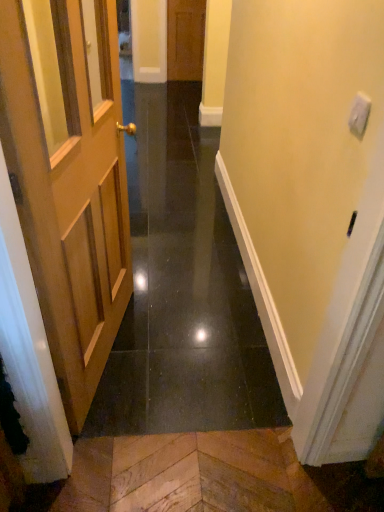
You are a GUI agent. You are given a task and a screenshot of the screen. Output one action in this format:
    pyautogui.click(x=<x>, y=<y>)
    Task: Click on the wooden door at center, the 2th door when ordered from front to back
    
    Given the screenshot: What is the action you would take?
    pyautogui.click(x=185, y=39)

Locate an element on the screen. This screenshot has height=512, width=384. wooden door at center, placed as the 1th door when sorted from back to front is located at coordinates (185, 39).

From the image's perspective, between wooden door at center, the 2th door when ordered from front to back, and light brown wooden door at left, the second door from the top, who is located below?

light brown wooden door at left, the second door from the top, is shown below in the image.

Between wooden door at center, the second door positioned from the bottom, and light brown wooden door at left, which ranks as the 2th door in back-to-front order, which one has smaller width?

Thinner between the two is wooden door at center, the second door positioned from the bottom.

Considering the relative sizes of wooden door at center, which is the first door in top-to-bottom order, and light brown wooden door at left, the 1th door from the front, in the image provided, is wooden door at center, which is the first door in top-to-bottom order, bigger than light brown wooden door at left, the 1th door from the front,?

No, wooden door at center, which is the first door in top-to-bottom order, is not bigger than light brown wooden door at left, the 1th door from the front.

Do you think wooden door at center, the second door positioned from the bottom, is within light brown wooden door at left, the second door from the top, or outside of it?

wooden door at center, the second door positioned from the bottom, is outside light brown wooden door at left, the second door from the top.

Who is taller, wooden door at left or light brown wooden door at left, acting as the 1th door starting from the bottom?

Standing taller between the two is light brown wooden door at left, acting as the 1th door starting from the bottom.

Does wooden door at left turn towards light brown wooden door at left, the second door from the top?

No.

At what (x,y) coordinates should I click in order to perform the action: click on door below the wooden door at left (from the image's perspective). Please return your answer as a coordinate pair (x, y). Looking at the image, I should click on (69, 178).

Is wooden door at left inside the boundaries of wooden door at center, which is the first door in top-to-bottom order, or outside?

wooden door at left is outside wooden door at center, which is the first door in top-to-bottom order.

Is wooden door at left with wooden door at center, the 2th door when ordered from front to back?

No, wooden door at left is not in contact with wooden door at center, the 2th door when ordered from front to back.

The image size is (384, 512). There is a wooden door at left. Find the location of `the 1st door above it (from a real-world perspective)`. the 1st door above it (from a real-world perspective) is located at coordinates (185, 39).

Who is taller, wooden door at left or wooden door at center, placed as the 1th door when sorted from back to front?

Standing taller between the two is wooden door at center, placed as the 1th door when sorted from back to front.

From the image's perspective, which is above, light brown wooden door at left, the 1th door from the front, or wooden door at center, placed as the 1th door when sorted from back to front?

wooden door at center, placed as the 1th door when sorted from back to front, appears higher in the image.

Can you confirm if light brown wooden door at left, acting as the 1th door starting from the bottom, is shorter than wooden door at center, which is the first door in top-to-bottom order?

In fact, light brown wooden door at left, acting as the 1th door starting from the bottom, may be taller than wooden door at center, which is the first door in top-to-bottom order.

Based on their sizes in the image, would you say light brown wooden door at left, the 1th door from the front, is bigger or smaller than wooden door at center, the 2th door when ordered from front to back?

In the image, light brown wooden door at left, the 1th door from the front, appears to be larger than wooden door at center, the 2th door when ordered from front to back.

Based on the photo, is wooden door at center, which is the first door in top-to-bottom order, positioned in front of wooden door at left?

No, wooden door at center, which is the first door in top-to-bottom order, is further to the viewer.

How many degrees apart are the facing directions of wooden door at center, placed as the 1th door when sorted from back to front, and wooden door at left?

They differ by 1.44 degrees in their facing directions.

Looking at this image, which point is more forward, (201, 3) or (148, 303)?

The point (148, 303) is closer.

Based on the photo, could you tell me if wooden door at center, which is the first door in top-to-bottom order, is turned towards wooden door at left?

Yes, wooden door at center, which is the first door in top-to-bottom order, faces towards wooden door at left.

Considering the relative positions of light brown wooden door at left, the second door from the top, and wooden door at left in the image provided, is light brown wooden door at left, the second door from the top, to the left of wooden door at left from the viewer's perspective?

Yes, light brown wooden door at left, the second door from the top, is to the left of wooden door at left.

Image resolution: width=384 pixels, height=512 pixels. I want to click on path that appears above the light brown wooden door at left, which ranks as the 2th door in back-to-front order (from the image's perspective), so click(182, 288).

Between light brown wooden door at left, acting as the 1th door starting from the bottom, and wooden door at left, which one has more height?

Standing taller between the two is light brown wooden door at left, acting as the 1th door starting from the bottom.

Consider the image. From the image's perspective, would you say light brown wooden door at left, the second door from the top, is shown under wooden door at left?

Yes.

Locate an element on the screen. The height and width of the screenshot is (512, 384). door behind the light brown wooden door at left, which ranks as the 2th door in back-to-front order is located at coordinates (185, 39).

Identify the location of door below the wooden door at left (from the image's perspective). The width and height of the screenshot is (384, 512). (69, 178).

Looking at the image, which one is located closer to light brown wooden door at left, the 1th door from the front, wooden door at center, which is the first door in top-to-bottom order, or wooden door at left?

wooden door at left lies closer to light brown wooden door at left, the 1th door from the front, than the other object.

Considering their positions, is light brown wooden door at left, the second door from the top, positioned closer to wooden door at left than wooden door at center, which is the first door in top-to-bottom order?

Based on the image, light brown wooden door at left, the second door from the top, appears to be nearer to wooden door at left.

Estimate the real-world distances between objects in this image. Which object is further from wooden door at center, the 2th door when ordered from front to back, wooden door at left or light brown wooden door at left, which ranks as the 2th door in back-to-front order?

The object further to wooden door at center, the 2th door when ordered from front to back, is light brown wooden door at left, which ranks as the 2th door in back-to-front order.

Looking at this image, based on their spatial positions, is light brown wooden door at left, the second door from the top, or wooden door at left further from wooden door at center, the 2th door when ordered from front to back?

The object further to wooden door at center, the 2th door when ordered from front to back, is light brown wooden door at left, the second door from the top.

Estimate the real-world distances between objects in this image. Which object is closer to wooden door at left, wooden door at center, the 2th door when ordered from front to back, or light brown wooden door at left, the second door from the top?

light brown wooden door at left, the second door from the top, lies closer to wooden door at left than the other object.

Which object lies further to the anchor point light brown wooden door at left, the 1th door from the front, wooden door at left or wooden door at center, which is the first door in top-to-bottom order?

wooden door at center, which is the first door in top-to-bottom order, lies further to light brown wooden door at left, the 1th door from the front, than the other object.

Locate an element on the screen. The width and height of the screenshot is (384, 512). path between light brown wooden door at left, the 1th door from the front, and wooden door at center, the second door positioned from the bottom, in the front-back direction is located at coordinates (182, 288).